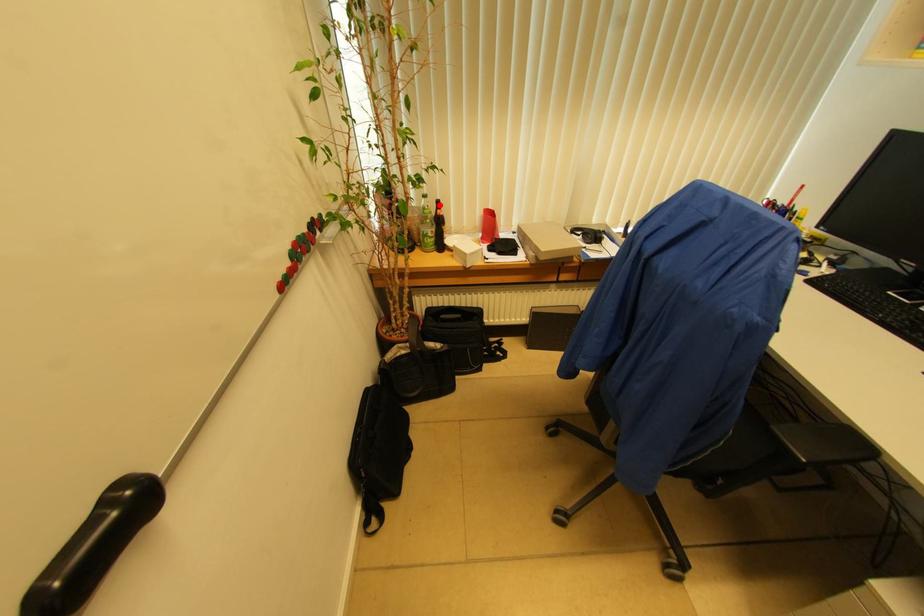
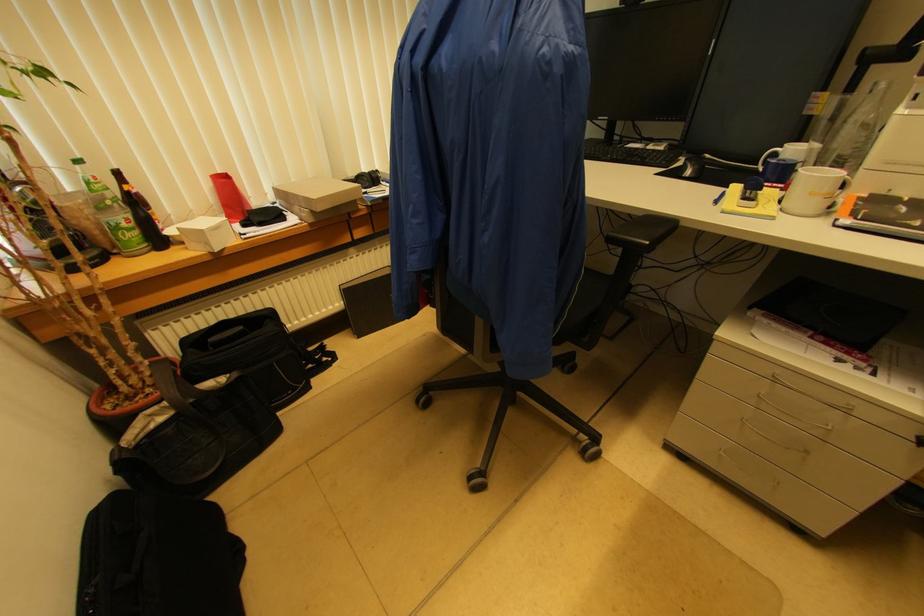
Question: A red point is marked in image1. In image2, is the corresponding 3D point closer to the camera or farther? Reply with the corresponding letter.

Choices:
 (A) The corresponding 3D point is closer.
 (B) The corresponding 3D point is farther.

Answer: (B)